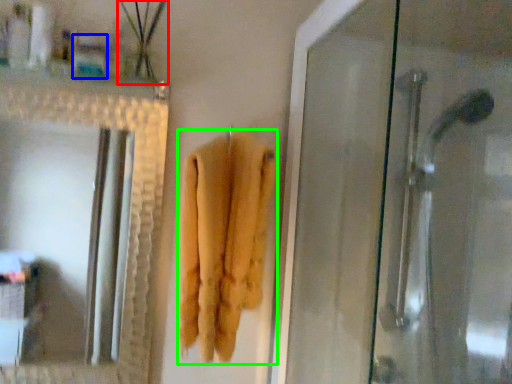
Question: Based on their relative distances, which object is farther from plant (highlighted by a red box)? Choose from toiletry (highlighted by a blue box) and towel (highlighted by a green box).

Choices:
 (A) toiletry
 (B) towel

Answer: (B)